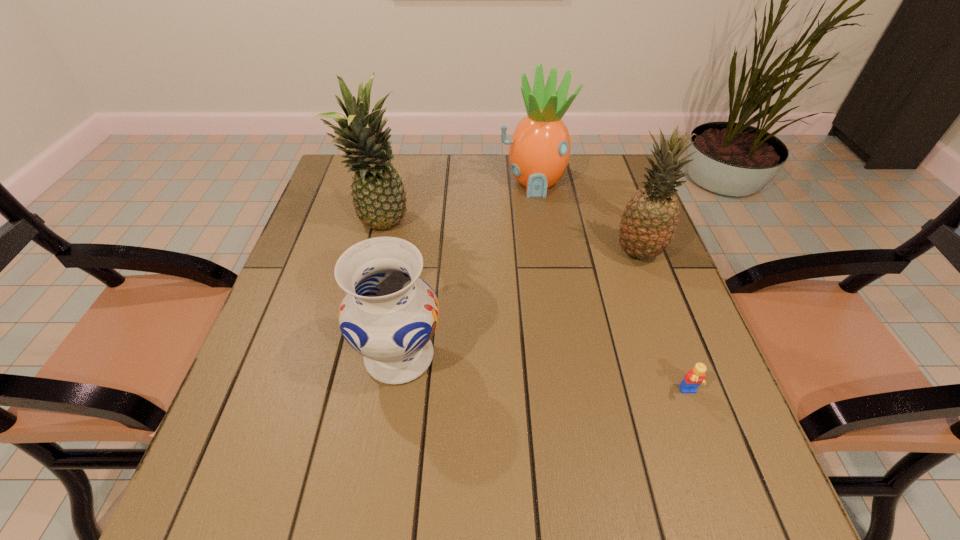
In the image, there is a desktop. Where is `vacant space at the near left corner`? The width and height of the screenshot is (960, 540). vacant space at the near left corner is located at coordinates (200, 513).

In the image, there is a desktop. Where is `vacant region at the far right corner`? This screenshot has width=960, height=540. vacant region at the far right corner is located at coordinates (616, 186).

This screenshot has height=540, width=960. Identify the location of free space between the farthest object and the leftmost pineapple. (457, 203).

Where is `unoccupied area between the shortest object and the second pineapple from left to right`? The image size is (960, 540). unoccupied area between the shortest object and the second pineapple from left to right is located at coordinates (612, 287).

Locate an element on the screen. Image resolution: width=960 pixels, height=540 pixels. vacant area between the second shortest object and the rightmost pineapple is located at coordinates (518, 304).

This screenshot has height=540, width=960. What are the coordinates of `vacant space in between the farthest object and the fourth tallest object` in the screenshot? It's located at (467, 269).

You are a GUI agent. You are given a task and a screenshot of the screen. Output one action in this format:
    pyautogui.click(x=<x>, y=<y>)
    Task: Click on the vacant space that's between the rightmost pineapple and the farthest pineapple
    The width and height of the screenshot is (960, 540).
    Given the screenshot: What is the action you would take?
    pyautogui.click(x=586, y=217)

The width and height of the screenshot is (960, 540). I want to click on free space between the leftmost pineapple and the rightmost pineapple, so click(x=510, y=239).

At what (x,y) coordinates should I click in order to perform the action: click on free space between the vase and the third object from right to left. Please return your answer as a coordinate pair (x, y). The height and width of the screenshot is (540, 960). Looking at the image, I should click on (467, 269).

At what (x,y) coordinates should I click in order to perform the action: click on blank region between the Lego and the leftmost pineapple. Please return your answer as a coordinate pair (x, y). Looking at the image, I should click on (535, 309).